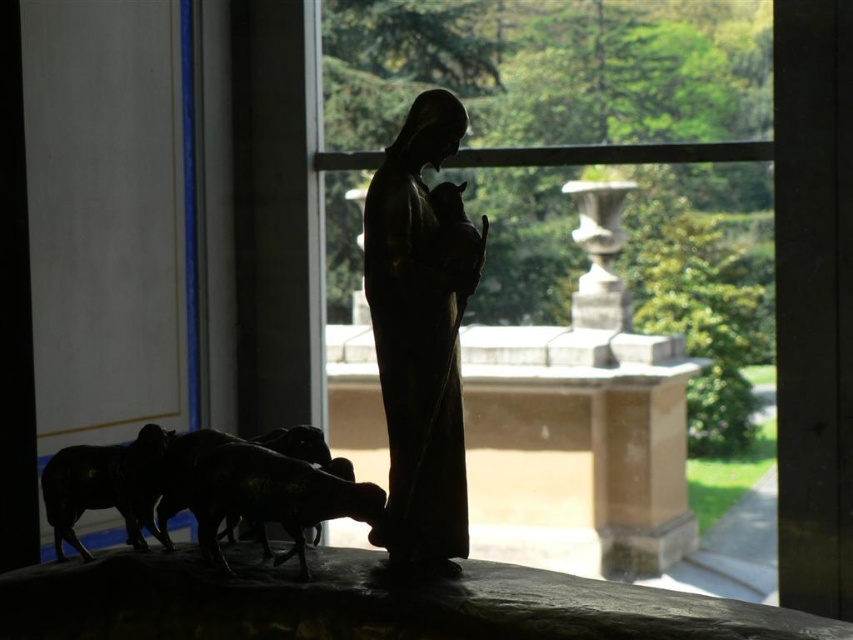
You are standing in front of the window looking at the statue and the garden. There are two points marked in the scene. Point A is at coordinates point (x=624, y=214) and Point B is at point (x=412, y=444). Which point is closer to you?

Point A at point (x=624, y=214) is closer to you because it is further to the viewer than point (x=412, y=444).

You are a painter standing 1 meter away from the transparent glass window at center. You want to paint the matte black statue at center. Can you reach the statue without moving your feet?

The transparent glass window at center and matte black statue at center are 1.37 meters apart. Since you are 1 meter away from the window, the statue is 0.37 meters beyond your reach. Therefore, you cannot reach the matte black statue at center without moving your feet.

You are standing in a room and want to look outside through the transparent glass window at center. Where should you look to see the statue silhouette and the garden beyond?

The transparent glass window at center is located at point [612,355] in the frame, so you should look towards that coordinate to see both the statue silhouette and the garden beyond through the window.